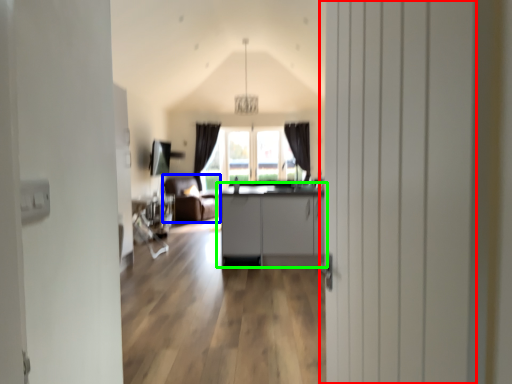
Question: Based on their relative distances, which object is farther from door (highlighted by a red box)? Choose from armchair (highlighted by a blue box) and cabinetry (highlighted by a green box).

Choices:
 (A) armchair
 (B) cabinetry

Answer: (A)